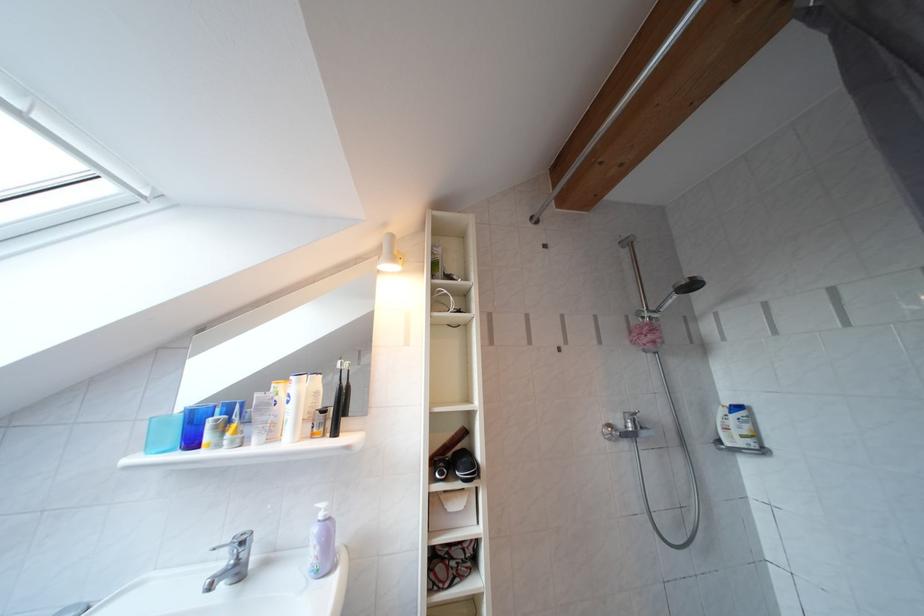
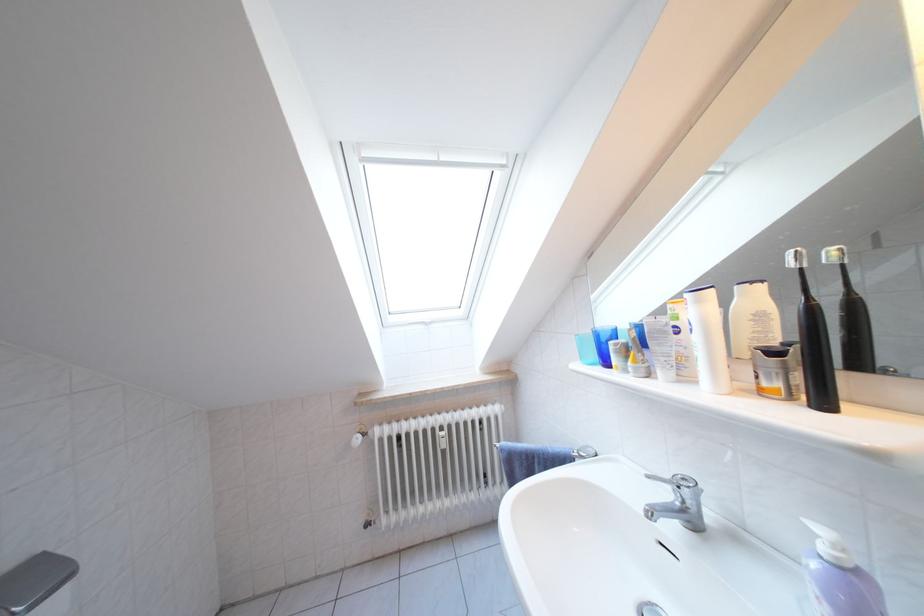
Locate, in the second image, the point that corresponds to (x=332, y=416) in the first image.

(783, 359)